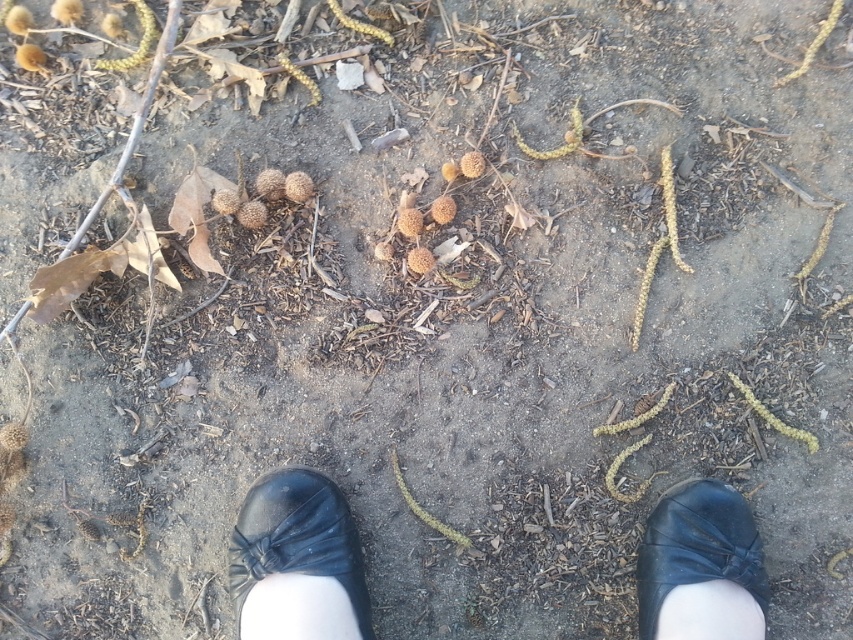
Question: Estimate the real-world distances between objects in this image. Which object is closer to the black leather shoe at lower center?

Choices:
 (A) black leather shoes at center
 (B) black leather shoe at lower right

Answer: (A)

Question: Can you confirm if black leather shoe at lower center is positioned above black leather shoe at lower right?

Choices:
 (A) yes
 (B) no

Answer: (A)

Question: Estimate the real-world distances between objects in this image. Which object is farther from the black leather shoes at center?

Choices:
 (A) black leather shoe at lower right
 (B) black leather shoe at lower center

Answer: (A)

Question: Can you confirm if black leather shoes at center is positioned below black leather shoe at lower center?

Choices:
 (A) yes
 (B) no

Answer: (B)

Question: Which point is closer to the camera taking this photo?

Choices:
 (A) (648, 625)
 (B) (643, 566)

Answer: (A)

Question: Is black leather shoes at center positioned at the back of black leather shoe at lower center?

Choices:
 (A) yes
 (B) no

Answer: (B)